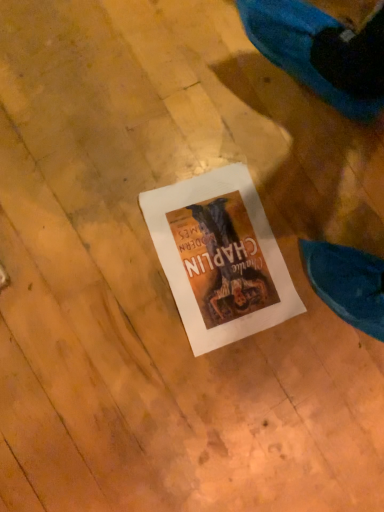
At what (x,y) coordinates should I click in order to perform the action: click on white paper poster at center. Please return your answer as a coordinate pair (x, y). The image size is (384, 512). Looking at the image, I should click on (220, 257).

What do you see at coordinates (220, 257) in the screenshot? I see `white paper poster at center` at bounding box center [220, 257].

What are the coordinates of `white paper poster at center` in the screenshot? It's located at (220, 257).